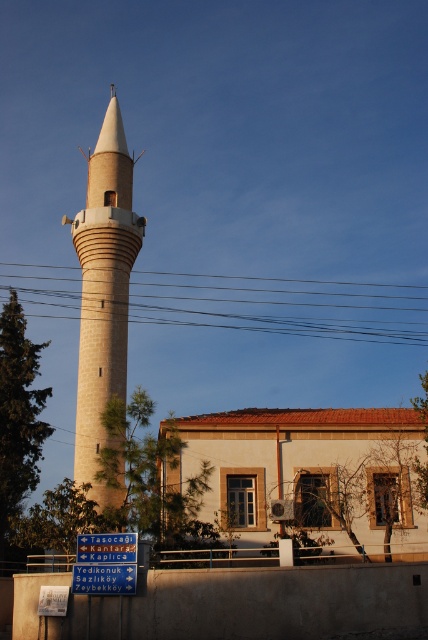
You are standing in front of the beige stone minaret at center and the brown wire at center. Which object is larger in size?

The beige stone minaret at center is bigger than the brown wire at center.

You are standing at the base of the minaret and want to place a small flag exactly at the point marked as point (x=116, y=342). Considering the flag is 1.5 meters tall, will it be visible from the partially open window of the building behind the wall?

The point (x=116, y=342) is 71.19 meters away from the viewer. Since the flag is only 1.5 meters tall, it may not be visible from the distant window due to the significant distance involved.